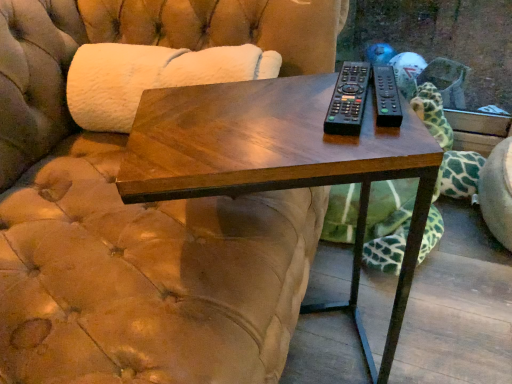
This screenshot has width=512, height=384. In order to click on free space in front of black plastic remote at center, the 2th remote positioned from the right in this screenshot , I will do `click(356, 142)`.